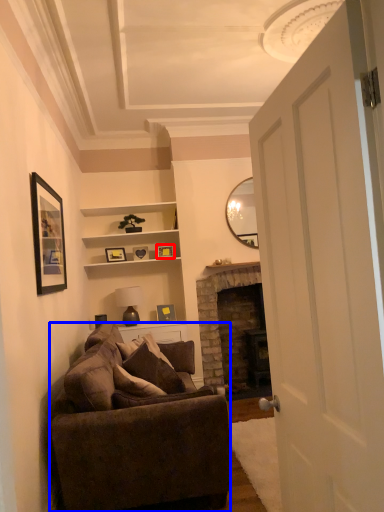
Question: Among these objects, which one is farthest to the camera, picture frame (highlighted by a red box) or studio couch (highlighted by a blue box)?

Choices:
 (A) picture frame
 (B) studio couch

Answer: (A)